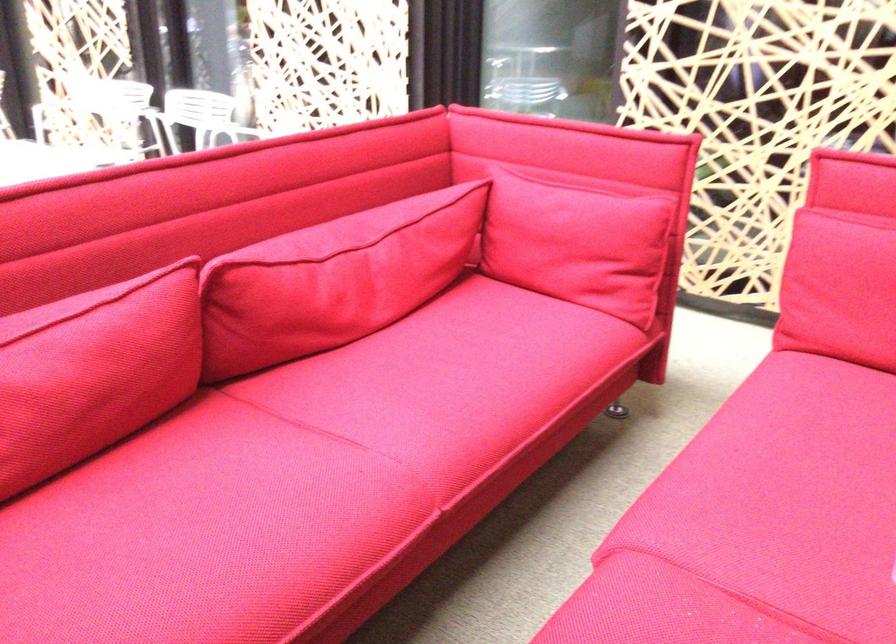
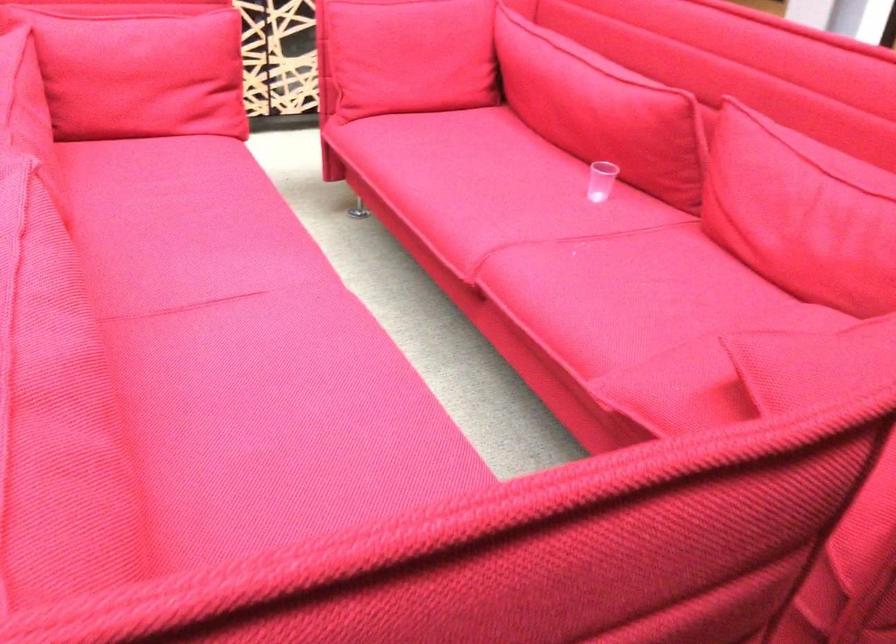
The point at (754, 469) is marked in the first image. Where is the corresponding point in the second image?

(488, 192)